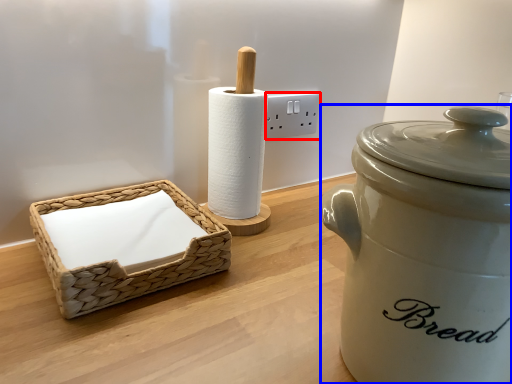
Question: Which object appears closest to the camera in this image, electric outlet (highlighted by a red box) or rice cooker (highlighted by a blue box)?

Choices:
 (A) electric outlet
 (B) rice cooker

Answer: (B)